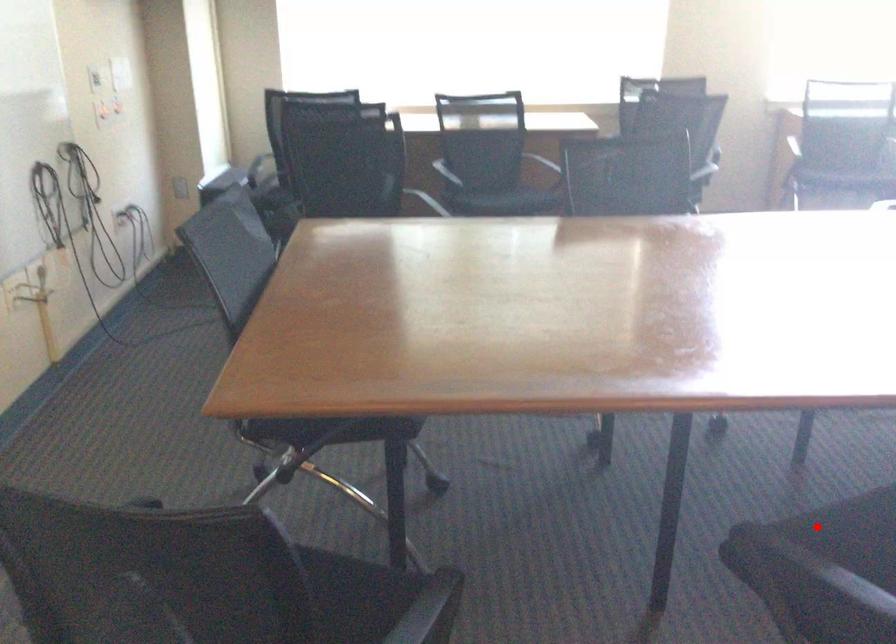
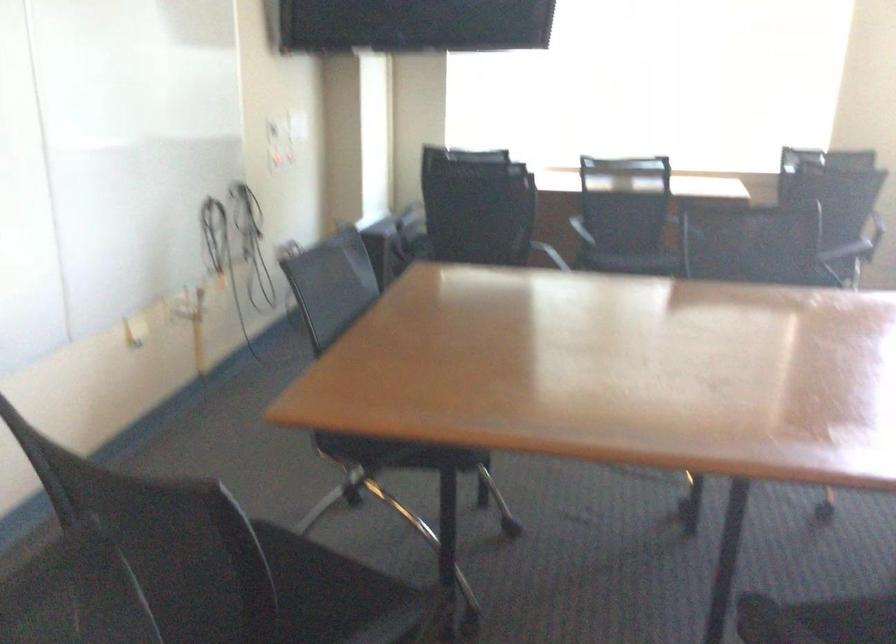
The point at the highlighted location is marked in the first image. Where is the corresponding point in the second image?

(849, 619)